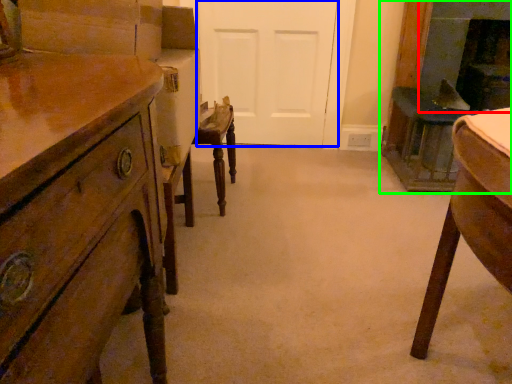
Question: Which object is the closest to the fireplace (highlighted by a red box)? Choose among these: door (highlighted by a blue box) or fireplace (highlighted by a green box).

Choices:
 (A) door
 (B) fireplace

Answer: (B)